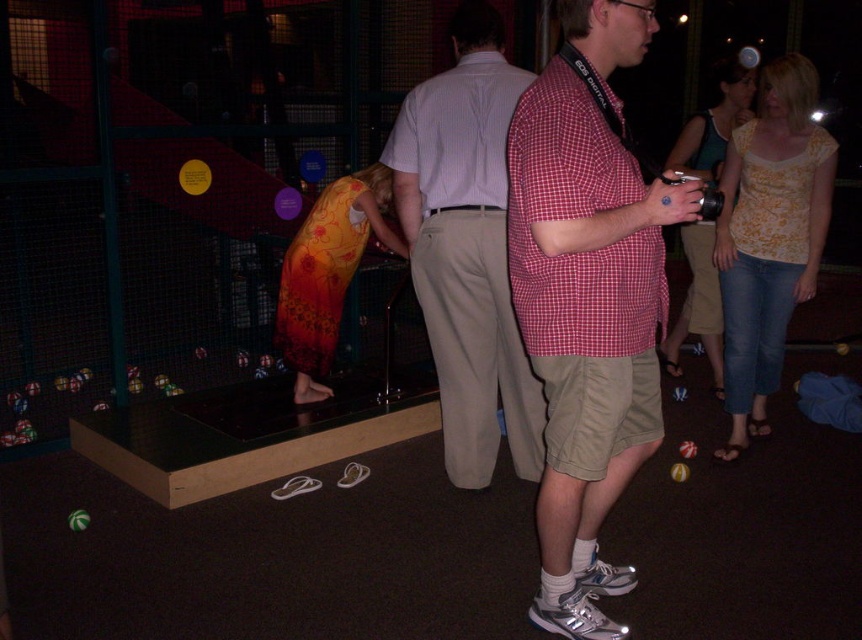
Is point (539, 145) less distant than point (416, 164)?

Yes, point (539, 145) is in front of point (416, 164).

Is red checkered shirt at center to the right of light brown cotton pants at center from the viewer's perspective?

Correct, you'll find red checkered shirt at center to the right of light brown cotton pants at center.

The width and height of the screenshot is (862, 640). Describe the element at coordinates (588, 300) in the screenshot. I see `red checkered shirt at center` at that location.

This screenshot has height=640, width=862. Find the location of `red checkered shirt at center`. red checkered shirt at center is located at coordinates (588, 300).